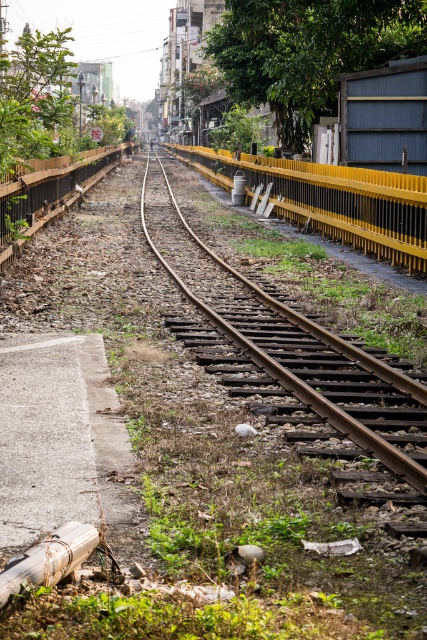
Which of these two, yellow metal rail at center or green leafy tree at upper left, stands shorter?

yellow metal rail at center

Does yellow metal rail at center appear over green leafy tree at upper left?

No, yellow metal rail at center is not above green leafy tree at upper left.

Which is behind, point (356, 196) or point (3, 122)?

Positioned behind is point (356, 196).

At what (x,y) coordinates should I click in order to perform the action: click on yellow metal rail at center. Please return your answer as a coordinate pair (x, y). Looking at the image, I should click on (333, 200).

Identify the location of green leafy tree at upper center. The height and width of the screenshot is (640, 427). click(x=307, y=51).

Does green leafy tree at upper center have a greater width compared to rusty metal track at center?

Indeed, green leafy tree at upper center has a greater width compared to rusty metal track at center.

Who is more forward, (240, 28) or (406, 378)?

Point (406, 378) is more forward.

This screenshot has width=427, height=640. I want to click on green leafy tree at upper center, so click(x=307, y=51).

Which of these two, rusty metal track at center or wooden fence at left, stands taller?

wooden fence at left is taller.

Find the location of a particular element. rusty metal track at center is located at coordinates (298, 381).

Identify the location of rusty metal track at center. (298, 381).